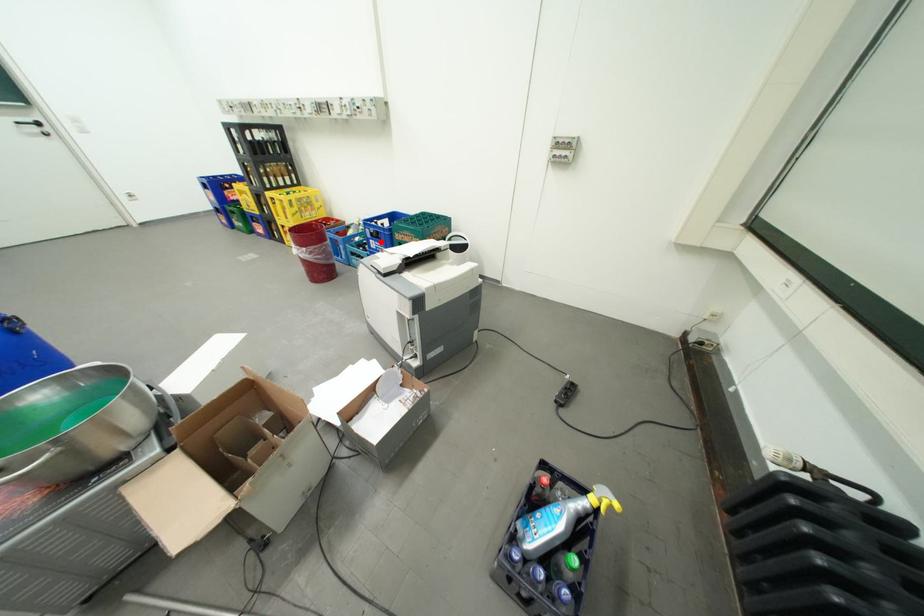
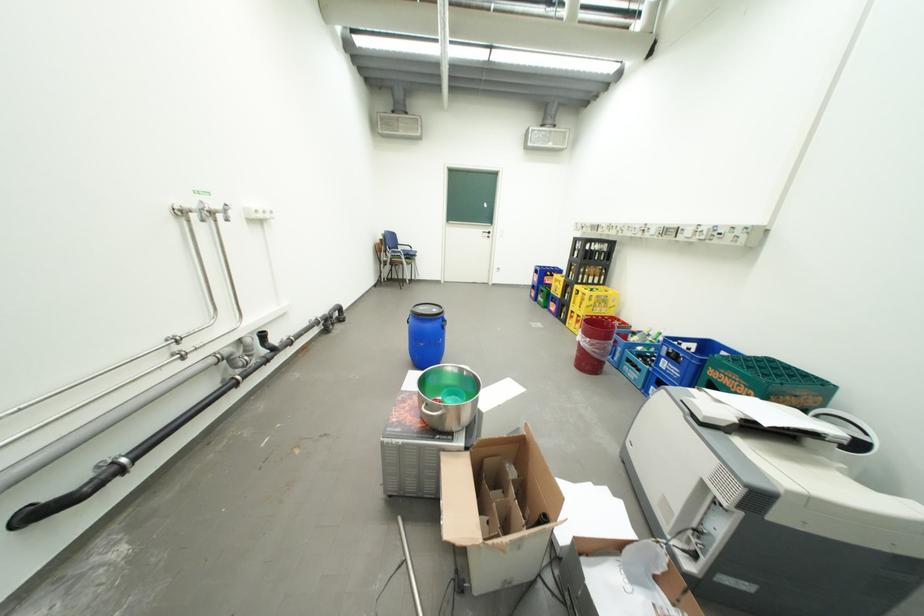
In the second image, find the point that corresponds to the highlighted location in the first image.

(674, 361)